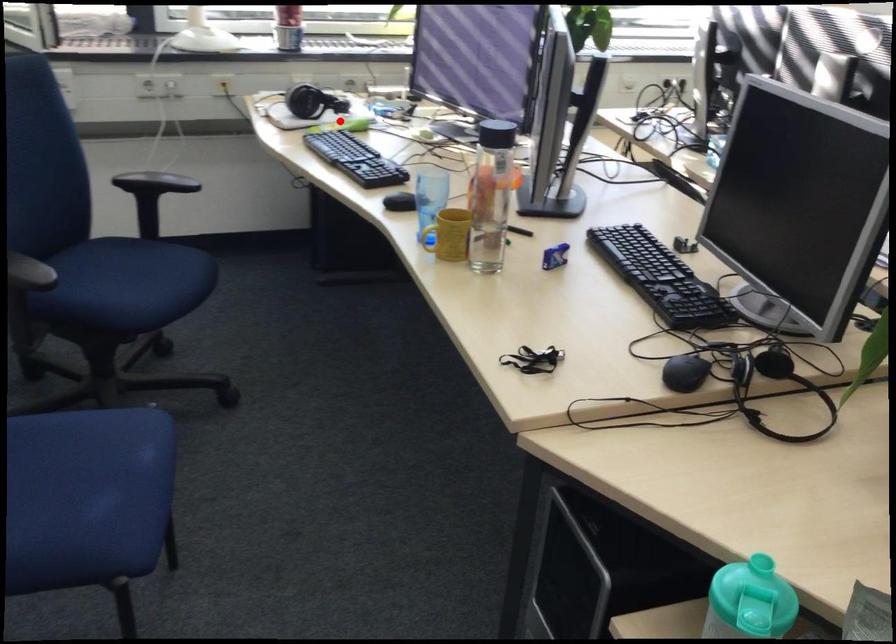
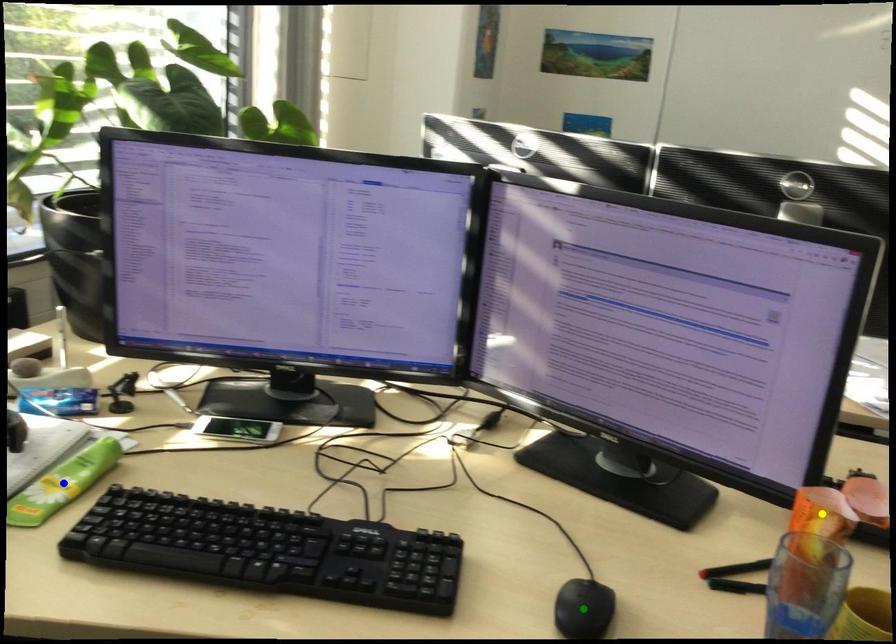
Question: I am providing you with two images of the same scene from different viewpoints. A red point is marked on the first image. You are given multiple points on the second image. Can you choose the point in image 2 that corresponds to the point in image 1?

Choices:
 (A) blue point
 (B) green point
 (C) yellow point

Answer: (A)